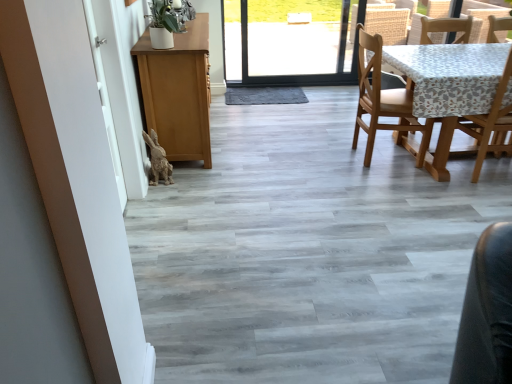
Question: Does wooden chair at right lie in front of white matte screen door at left?

Choices:
 (A) yes
 (B) no

Answer: (B)

Question: Is wooden chair at right thinner than white matte screen door at left?

Choices:
 (A) no
 (B) yes

Answer: (A)

Question: Considering the relative sizes of wooden chair at right and white matte screen door at left in the image provided, is wooden chair at right bigger than white matte screen door at left?

Choices:
 (A) yes
 (B) no

Answer: (A)

Question: From a real-world perspective, is wooden chair at right positioned under white matte screen door at left based on gravity?

Choices:
 (A) yes
 (B) no

Answer: (B)

Question: From the image's perspective, is wooden chair at right over white matte screen door at left?

Choices:
 (A) no
 (B) yes

Answer: (B)

Question: Is wooden chair at right directly adjacent to white matte screen door at left?

Choices:
 (A) yes
 (B) no

Answer: (B)

Question: From a real-world perspective, is wooden chair at right, which is counted as the first chair, starting from the right, physically above white matte screen door at left?

Choices:
 (A) no
 (B) yes

Answer: (A)

Question: Does wooden chair at right, acting as the second chair starting from the left, appear on the left side of white matte screen door at left?

Choices:
 (A) no
 (B) yes

Answer: (A)

Question: From the image's perspective, is wooden chair at right, which is counted as the first chair, starting from the right, under white matte screen door at left?

Choices:
 (A) no
 (B) yes

Answer: (A)

Question: Considering the relative sizes of wooden chair at right, acting as the second chair starting from the left, and white matte screen door at left in the image provided, is wooden chair at right, acting as the second chair starting from the left, shorter than white matte screen door at left?

Choices:
 (A) yes
 (B) no

Answer: (A)

Question: From a real-world perspective, is wooden chair at right, which is counted as the first chair, starting from the right, physically below white matte screen door at left?

Choices:
 (A) no
 (B) yes

Answer: (B)

Question: Is wooden chair at right, acting as the second chair starting from the left, looking in the opposite direction of white matte screen door at left?

Choices:
 (A) yes
 (B) no

Answer: (B)

Question: Is wooden chair at right taller than wooden chair at right, acting as the second chair starting from the left?

Choices:
 (A) no
 (B) yes

Answer: (A)